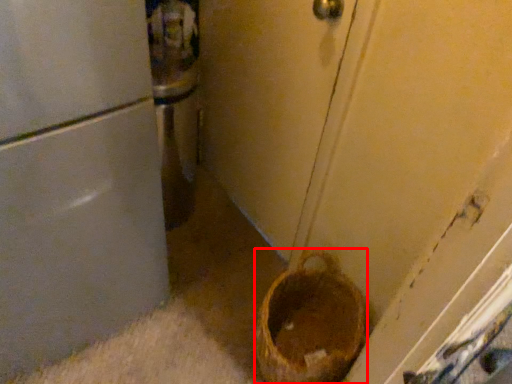
Question: From the image's perspective, considering the relative positions of basket container (annotated by the red box) and door in the image provided, where is basket container (annotated by the red box) located with respect to the staircase?

Choices:
 (A) below
 (B) above

Answer: (A)